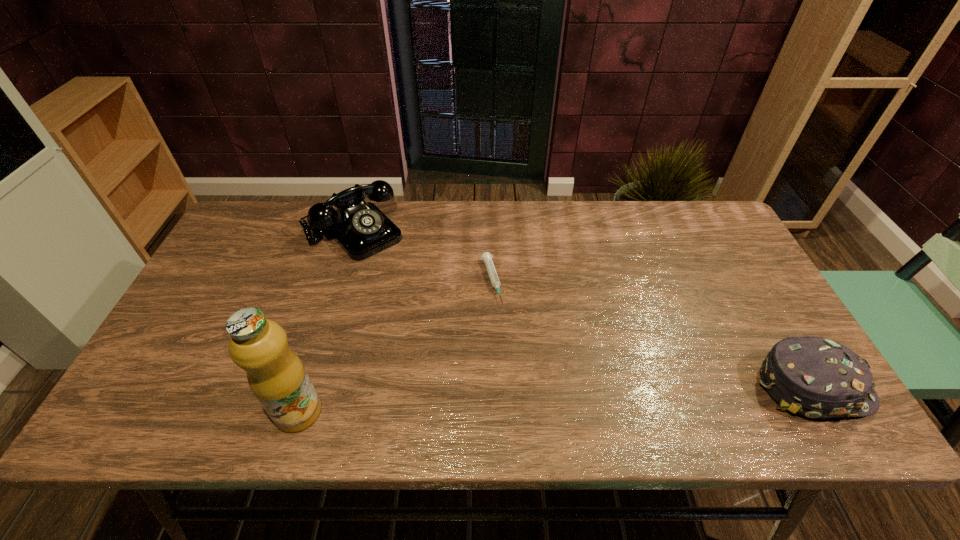
Find the location of a particular element. The width and height of the screenshot is (960, 540). free space located 0.350m on the dial of the telephone is located at coordinates (447, 327).

The image size is (960, 540). Identify the location of free space located 0.290m on the dial of the telephone. (434, 313).

Locate an element on the screen. This screenshot has height=540, width=960. object present at the far edge is located at coordinates (361, 229).

Identify the location of fruit juice positioned at the near edge. (276, 375).

Image resolution: width=960 pixels, height=540 pixels. I want to click on headwear that is at the near edge, so click(815, 377).

This screenshot has height=540, width=960. What are the coordinates of `object located at the right edge` in the screenshot? It's located at (815, 377).

You are a GUI agent. You are given a task and a screenshot of the screen. Output one action in this format:
    pyautogui.click(x=<x>, y=<y>)
    Task: Click on the object that is at the near right corner
    The image size is (960, 540).
    Given the screenshot: What is the action you would take?
    tap(815, 377)

Image resolution: width=960 pixels, height=540 pixels. I want to click on vacant space at the far edge, so click(603, 240).

Locate an element on the screen. The width and height of the screenshot is (960, 540). vacant space at the near edge is located at coordinates (698, 374).

Find the location of a particular element. This screenshot has width=960, height=540. vacant region at the left edge is located at coordinates (218, 260).